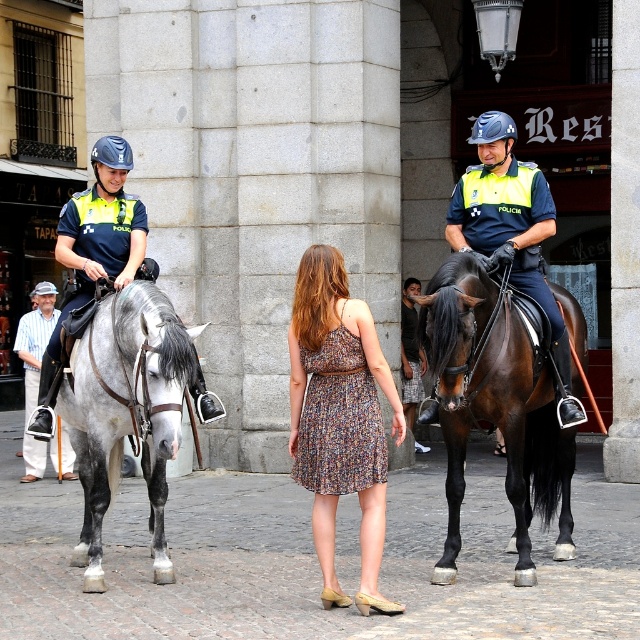
Question: Can you confirm if brown glossy horse at center is smaller than striped cotton shirt at left?

Choices:
 (A) yes
 (B) no

Answer: (B)

Question: Can you confirm if floral dress at center is positioned above striped cotton shirt at left?

Choices:
 (A) yes
 (B) no

Answer: (A)

Question: Which object is farther from the camera taking this photo?

Choices:
 (A) floral dress at center
 (B) striped cotton shirt at left
 (C) matte black helmet at upper left
 (D) gray glossy horse at left

Answer: (B)

Question: Which point is closer to the camera?

Choices:
 (A) gray glossy horse at left
 (B) brown glossy horse at center
 (C) shiny blue uniform at center
 (D) floral dress at center

Answer: (A)

Question: Can you confirm if brown glossy horse at center is wider than floral dress at center?

Choices:
 (A) yes
 (B) no

Answer: (A)

Question: Which of these objects is positioned farthest from the floral dress at center?

Choices:
 (A) brown glossy horse at center
 (B) striped cotton shirt at left
 (C) gray glossy horse at left

Answer: (B)